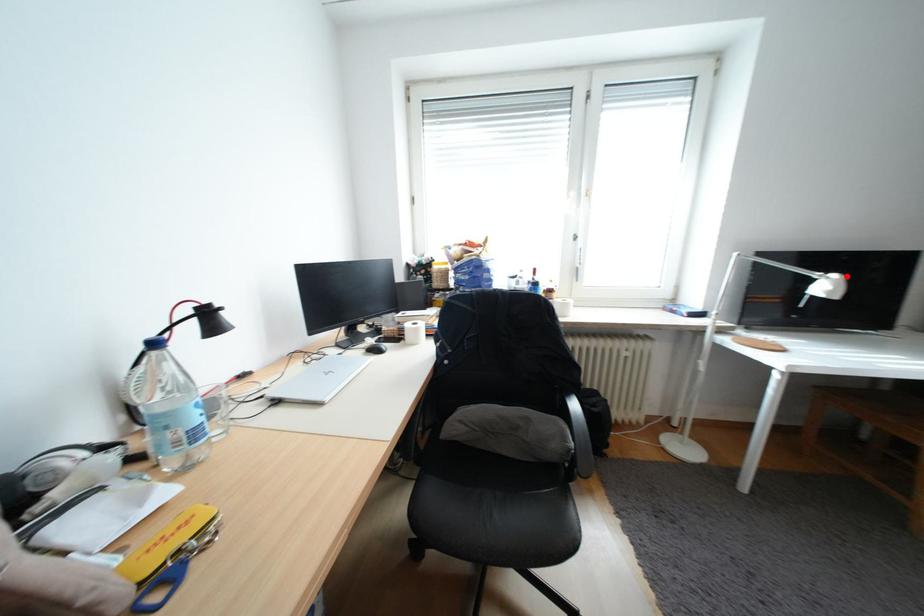
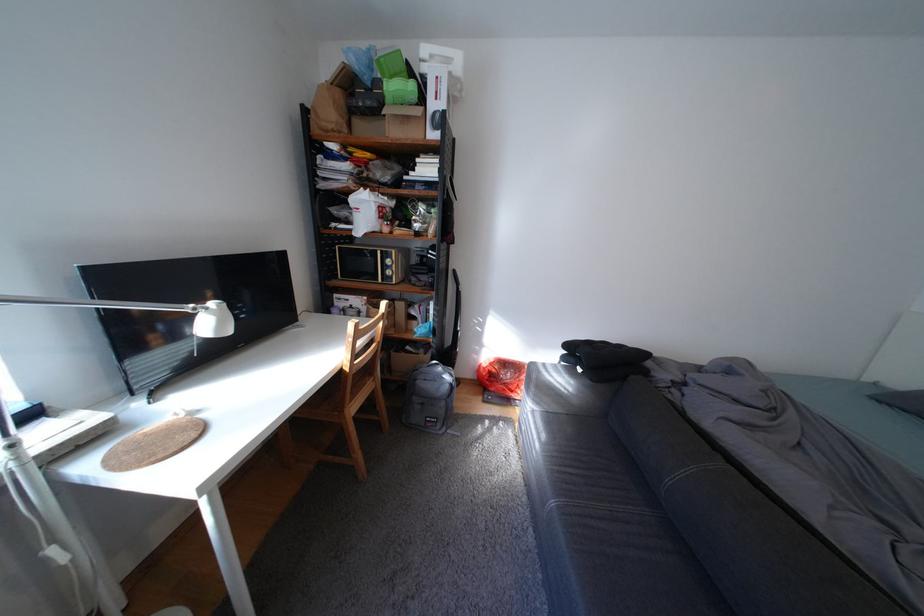
Question: I am providing you with two images of the same scene from different viewpoints. A red point is marked on the first image. Can you still see the location of the red point in image 2?

Choices:
 (A) Yes
 (B) No

Answer: (A)